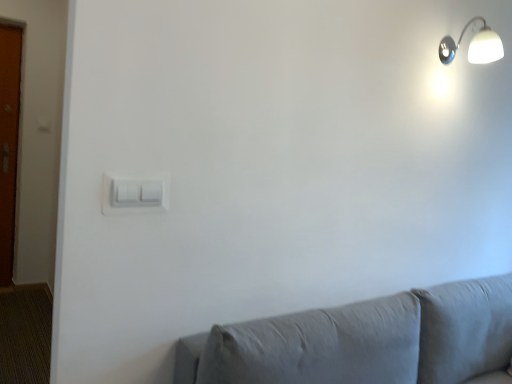
Question: From a real-world perspective, is white glossy wall lamp at upper right physically below white plastic light switch at center?

Choices:
 (A) no
 (B) yes

Answer: (A)

Question: Are white glossy wall lamp at upper right and white plastic light switch at center making contact?

Choices:
 (A) yes
 (B) no

Answer: (B)

Question: Is white glossy wall lamp at upper right aimed at white plastic light switch at center?

Choices:
 (A) yes
 (B) no

Answer: (B)

Question: Is white glossy wall lamp at upper right behind white plastic light switch at center?

Choices:
 (A) no
 (B) yes

Answer: (B)

Question: From the image's perspective, is white glossy wall lamp at upper right over white plastic light switch at center?

Choices:
 (A) yes
 (B) no

Answer: (A)

Question: Does white glossy wall lamp at upper right have a greater height compared to white plastic light switch at center?

Choices:
 (A) yes
 (B) no

Answer: (A)

Question: Is white plastic light switch at center located outside white glossy wall lamp at upper right?

Choices:
 (A) no
 (B) yes

Answer: (B)

Question: Does white plastic light switch at center have a lesser height compared to white glossy wall lamp at upper right?

Choices:
 (A) no
 (B) yes

Answer: (B)

Question: Is white glossy wall lamp at upper right inside white plastic light switch at center?

Choices:
 (A) yes
 (B) no

Answer: (B)

Question: Can you confirm if white plastic light switch at center is thinner than white glossy wall lamp at upper right?

Choices:
 (A) yes
 (B) no

Answer: (A)

Question: From a real-world perspective, is white plastic light switch at center under white glossy wall lamp at upper right?

Choices:
 (A) no
 (B) yes

Answer: (B)

Question: Is white plastic light switch at center in front of white glossy wall lamp at upper right?

Choices:
 (A) yes
 (B) no

Answer: (A)

Question: Is white glossy wall lamp at upper right in front of or behind white plastic light switch at center in the image?

Choices:
 (A) behind
 (B) front

Answer: (A)